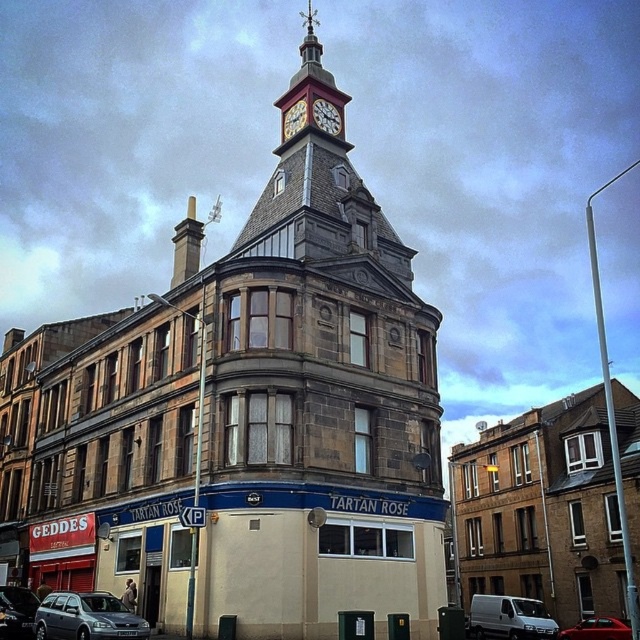
Between shiny black car at lower left and white clock face at upper center, which one has more height?

Standing taller between the two is white clock face at upper center.

Is point (35, 611) farther from camera compared to point (298, 113)?

No, (35, 611) is closer to viewer.

The height and width of the screenshot is (640, 640). I want to click on shiny black car at lower left, so click(17, 612).

Does shiny red car at center have a greater width compared to white clock face at upper center?

Indeed, shiny red car at center has a greater width compared to white clock face at upper center.

Does point (579, 627) come in front of point (301, 104)?

That is True.

The width and height of the screenshot is (640, 640). I want to click on shiny red car at center, so click(x=596, y=628).

Is white matte van at center closer to the viewer compared to shiny red car at center?

That is False.

Which is in front, point (477, 637) or point (624, 620)?

Positioned in front is point (477, 637).

At what (x,y) coordinates should I click in order to perform the action: click on white matte van at center. Please return your answer as a coordinate pair (x, y). Looking at the image, I should click on (509, 618).

Image resolution: width=640 pixels, height=640 pixels. Find the location of `white matte van at center`. white matte van at center is located at coordinates (509, 618).